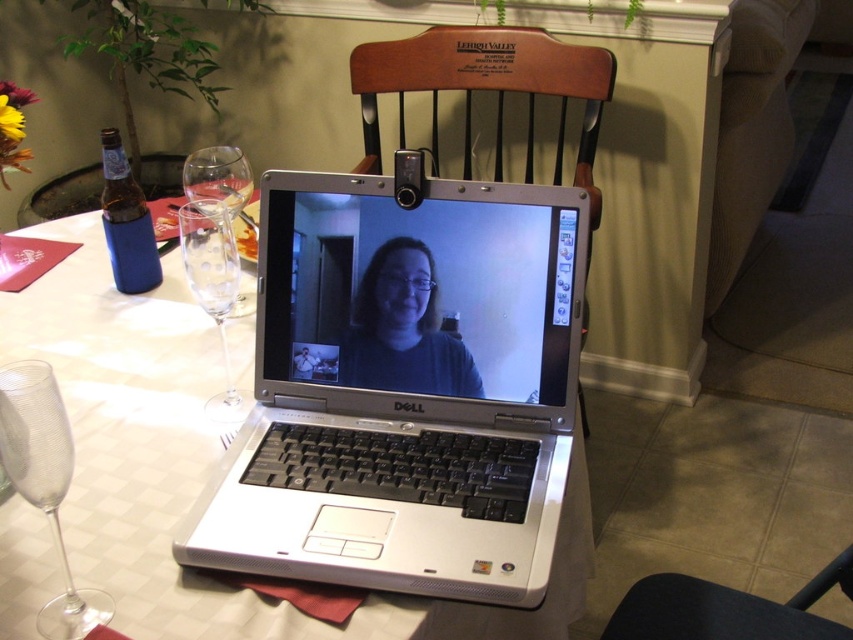
This screenshot has height=640, width=853. I want to click on black fabric chair at lower right, so click(x=726, y=609).

This screenshot has height=640, width=853. What are the coordinates of `black fabric chair at lower right` in the screenshot? It's located at (726, 609).

Does silver/black laptop at center lie in front of black fabric chair at lower right?

Yes, silver/black laptop at center is closer to the viewer.

Which is in front, point (450, 502) or point (799, 630)?

Point (450, 502) is in front.

You are a GUI agent. You are given a task and a screenshot of the screen. Output one action in this format:
    pyautogui.click(x=<x>, y=<y>)
    Task: Click on the silver/black laptop at center
    Image resolution: width=853 pixels, height=640 pixels.
    Given the screenshot: What is the action you would take?
    pyautogui.click(x=404, y=390)

Is blue neoprene bottle at left behind clear glass wine glass at left?

Yes, it is.

Does blue neoprene bottle at left have a lesser width compared to clear glass wine glass at left?

Yes.

Between point (120, 152) and point (190, 196), which one is positioned behind?

The point (120, 152) is behind.

You are a GUI agent. You are given a task and a screenshot of the screen. Output one action in this format:
    pyautogui.click(x=<x>, y=<y>)
    Task: Click on the blue neoprene bottle at left
    The image size is (853, 640).
    Given the screenshot: What is the action you would take?
    pyautogui.click(x=126, y=221)